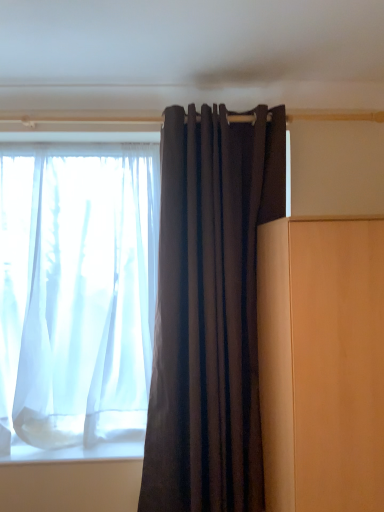
Question: From a real-world perspective, is matte wood cabinet at right physically above sheer white curtain at left, the second curtain in the front-to-back sequence?

Choices:
 (A) no
 (B) yes

Answer: (A)

Question: From the image's perspective, does matte wood cabinet at right appear higher than sheer white curtain at left, the second curtain in the front-to-back sequence?

Choices:
 (A) no
 (B) yes

Answer: (A)

Question: Is matte wood cabinet at right to the right of sheer white curtain at left, which is counted as the 1th curtain, starting from the back, from the viewer's perspective?

Choices:
 (A) no
 (B) yes

Answer: (B)

Question: Can you see matte wood cabinet at right touching sheer white curtain at left, marked as the 1th curtain in a left-to-right arrangement?

Choices:
 (A) no
 (B) yes

Answer: (A)

Question: Is matte wood cabinet at right oriented away from sheer white curtain at left, the second curtain in the front-to-back sequence?

Choices:
 (A) no
 (B) yes

Answer: (A)

Question: Can you confirm if matte wood cabinet at right is taller than sheer white curtain at left, the second curtain in the front-to-back sequence?

Choices:
 (A) yes
 (B) no

Answer: (B)

Question: Is dark matte fabric curtain at center, positioned as the 2th curtain in left-to-right order, to the left of sheer white curtain at left, marked as the 1th curtain in a left-to-right arrangement, from the viewer's perspective?

Choices:
 (A) yes
 (B) no

Answer: (B)

Question: Does dark matte fabric curtain at center, the first curtain positioned from the front, touch sheer white curtain at left, which is counted as the 1th curtain, starting from the back?

Choices:
 (A) no
 (B) yes

Answer: (A)

Question: Is dark matte fabric curtain at center, which is counted as the 2th curtain, starting from the back, facing away from sheer white curtain at left, the second curtain in the front-to-back sequence?

Choices:
 (A) no
 (B) yes

Answer: (A)

Question: Is dark matte fabric curtain at center, which is counted as the 2th curtain, starting from the back, positioned behind sheer white curtain at left, the second curtain in the front-to-back sequence?

Choices:
 (A) yes
 (B) no

Answer: (B)

Question: From the image's perspective, would you say dark matte fabric curtain at center, which is counted as the 2th curtain, starting from the back, is shown under sheer white curtain at left, marked as the 1th curtain in a left-to-right arrangement?

Choices:
 (A) yes
 (B) no

Answer: (A)

Question: Does dark matte fabric curtain at center, which is the first curtain in right-to-left order, contain sheer white curtain at left, which is counted as the 1th curtain, starting from the back?

Choices:
 (A) yes
 (B) no

Answer: (B)

Question: Is sheer white curtain at left, which is counted as the 1th curtain, starting from the back, at the left side of matte wood cabinet at right?

Choices:
 (A) no
 (B) yes

Answer: (B)